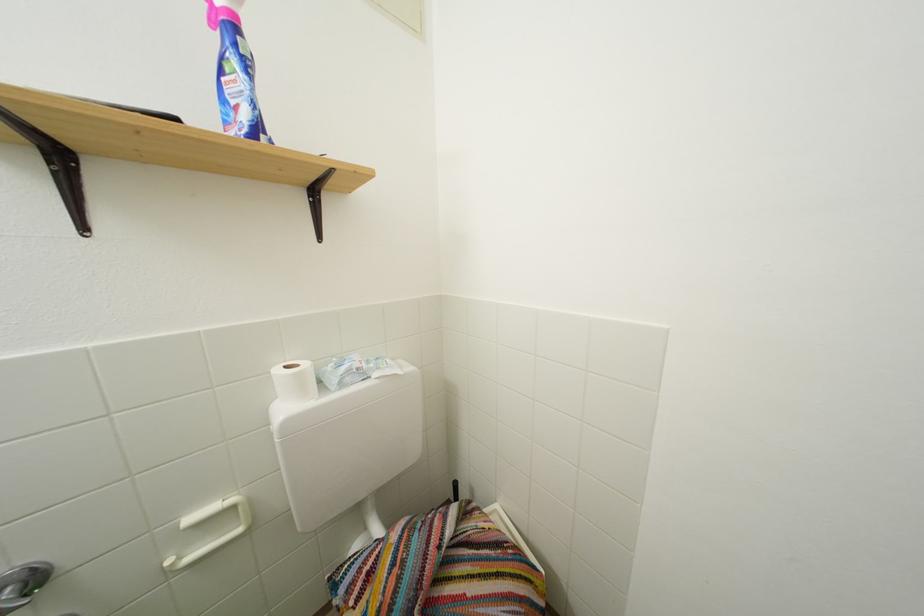
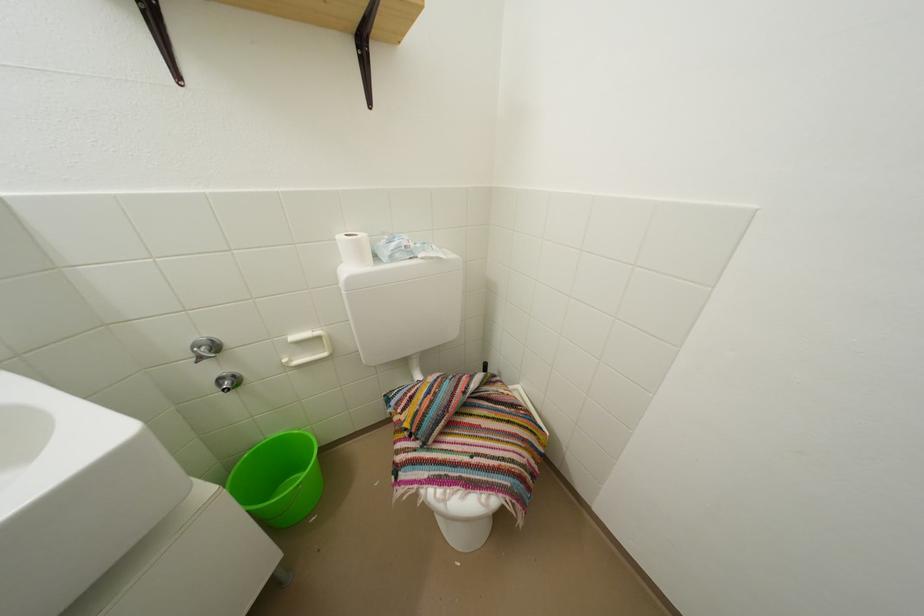
The point at (351, 375) is marked in the first image. Where is the corresponding point in the second image?

(402, 251)